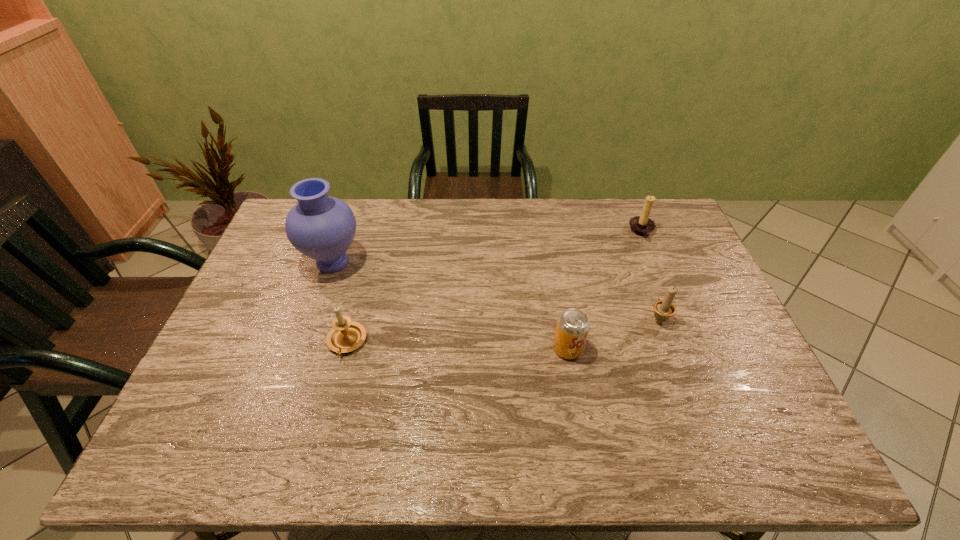
Identify the location of the tallest object. (321, 227).

What are the coordinates of `the farthest candle holder` in the screenshot? It's located at (642, 225).

The height and width of the screenshot is (540, 960). I want to click on the leftmost candle holder, so click(x=346, y=335).

Find the location of a particular element. The image size is (960, 540). pop (soda) is located at coordinates (572, 327).

Find the location of a particular element. blank area located on the back of the vase is located at coordinates (344, 231).

I want to click on vacant space located on the wick of the farthest candle holder, so pos(575,232).

This screenshot has width=960, height=540. In order to click on vacant space located on the wick of the farthest candle holder in this screenshot , I will do `click(527, 232)`.

Locate an element on the screen. The width and height of the screenshot is (960, 540). vacant space situated 0.250m on the wick of the farthest candle holder is located at coordinates [558, 232].

Locate an element on the screen. The image size is (960, 540). vacant space located 0.210m with a handle on the side of the leftmost candle holder is located at coordinates (322, 438).

The image size is (960, 540). I want to click on vacant space situated on the back of the third object from left to right, so click(563, 318).